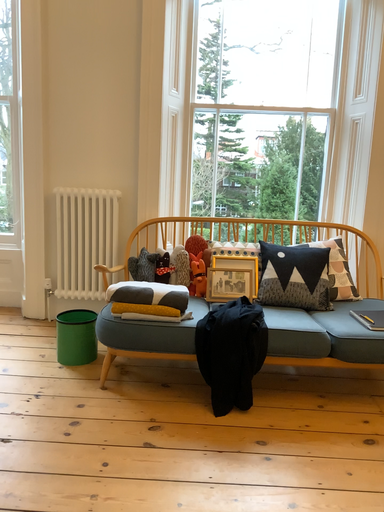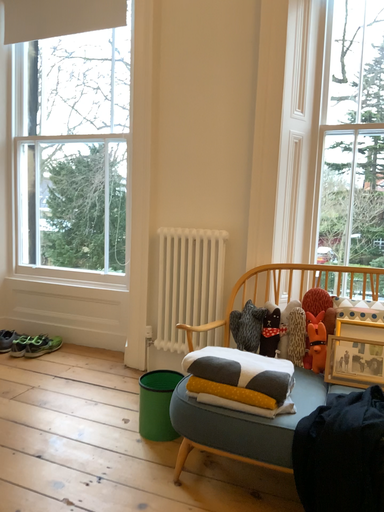
Question: Which way did the camera rotate in the video?

Choices:
 (A) rotated right
 (B) rotated left

Answer: (B)